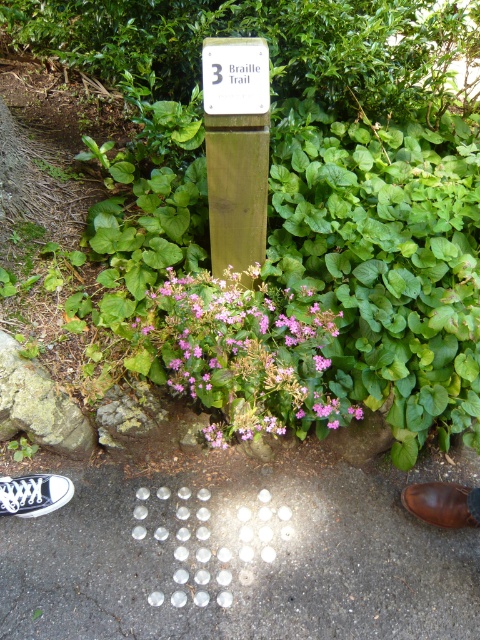
Question: Which of these objects is positioned closest to the brown leather shoe at lower right?

Choices:
 (A) green leafy bush at upper center
 (B) pink matte flowers at center
 (C) translucent glass arrow at center
 (D) blue canvas shoe at lower left

Answer: (C)

Question: Among these objects, which one is nearest to the camera?

Choices:
 (A) brown leather shoe at lower right
 (B) green leafy bush at upper center

Answer: (A)

Question: Where is pink matte flowers at center located in relation to blue canvas shoe at lower left in the image?

Choices:
 (A) right
 (B) left

Answer: (A)

Question: Is translucent glass arrow at center positioned before white plastic sign at center?

Choices:
 (A) yes
 (B) no

Answer: (A)

Question: Considering the real-world distances, which object is closest to the translucent glass arrow at center?

Choices:
 (A) brown leather shoe at lower right
 (B) white plastic sign at center
 (C) wooden signpost at center
 (D) green leafy bush at upper center

Answer: (A)

Question: Is green leafy bush at upper center thinner than pink matte flowers at center?

Choices:
 (A) yes
 (B) no

Answer: (B)